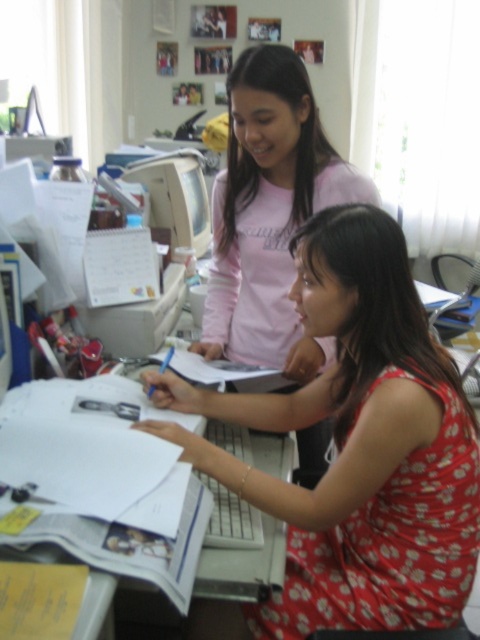
Question: Which is farther from the pink cotton shirt at upper center?

Choices:
 (A) matte plastic monitor at center
 (B) floral fabric dress at center

Answer: (A)

Question: Among these points, which one is farthest from the camera?

Choices:
 (A) (351, 404)
 (B) (178, 230)
 (C) (217, 292)

Answer: (B)

Question: Is pink cotton shirt at upper center positioned at the back of matte plastic monitor at center?

Choices:
 (A) no
 (B) yes

Answer: (A)

Question: Observing the image, what is the correct spatial positioning of floral fabric dress at center in reference to matte plastic monitor at center?

Choices:
 (A) left
 (B) right

Answer: (B)

Question: Which is nearer to the matte plastic monitor at center?

Choices:
 (A) floral fabric dress at center
 (B) pink cotton shirt at upper center

Answer: (B)

Question: From the image, what is the correct spatial relationship of floral fabric dress at center in relation to matte plastic monitor at center?

Choices:
 (A) below
 (B) above

Answer: (A)